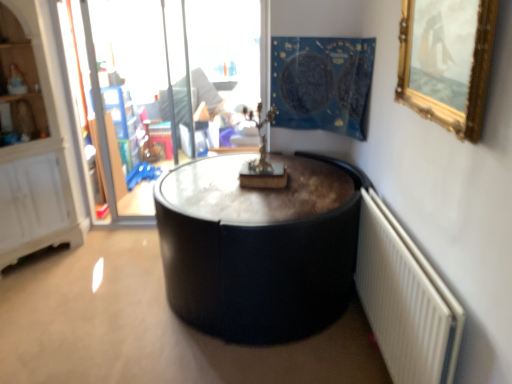
Question: Is point (391, 256) positioned closer to the camera than point (220, 84)?

Choices:
 (A) farther
 (B) closer

Answer: (B)

Question: In terms of size, does white textured radiator at lower right appear bigger or smaller than transparent glass door at upper left?

Choices:
 (A) big
 (B) small

Answer: (B)

Question: Which object is positioned closest to the white textured radiator at lower right?

Choices:
 (A) transparent glass door at upper left
 (B) blue fabric tapestry at upper center
 (C) gold-framed mirror at upper right

Answer: (C)

Question: Estimate the real-world distances between objects in this image. Which object is farther from the blue fabric tapestry at upper center?

Choices:
 (A) gold-framed mirror at upper right
 (B) transparent glass door at upper left
 (C) white textured radiator at lower right

Answer: (C)